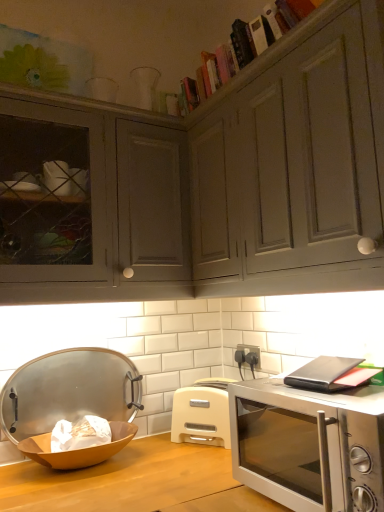
Question: Considering the relative sizes of metallic silver tray at left and silver metallic microwave oven at lower right in the image provided, is metallic silver tray at left bigger than silver metallic microwave oven at lower right?

Choices:
 (A) no
 (B) yes

Answer: (A)

Question: Is there a large distance between metallic silver tray at left and silver metallic microwave oven at lower right?

Choices:
 (A) yes
 (B) no

Answer: (B)

Question: Is silver metallic microwave oven at lower right located within metallic silver tray at left?

Choices:
 (A) no
 (B) yes

Answer: (A)

Question: Is metallic silver tray at left at the left side of silver metallic microwave oven at lower right?

Choices:
 (A) no
 (B) yes

Answer: (B)

Question: Is metallic silver tray at left oriented towards silver metallic microwave oven at lower right?

Choices:
 (A) yes
 (B) no

Answer: (A)

Question: Can you confirm if metallic silver tray at left is shorter than silver metallic microwave oven at lower right?

Choices:
 (A) no
 (B) yes

Answer: (A)

Question: Is wooden bowl at lower left positioned with its back to beige plastic toaster at center?

Choices:
 (A) yes
 (B) no

Answer: (B)

Question: Is wooden bowl at lower left far away from beige plastic toaster at center?

Choices:
 (A) yes
 (B) no

Answer: (B)

Question: Is wooden bowl at lower left to the left of beige plastic toaster at center from the viewer's perspective?

Choices:
 (A) yes
 (B) no

Answer: (A)

Question: Is wooden bowl at lower left at the right side of beige plastic toaster at center?

Choices:
 (A) no
 (B) yes

Answer: (A)

Question: Can we say wooden bowl at lower left lies outside beige plastic toaster at center?

Choices:
 (A) yes
 (B) no

Answer: (A)

Question: From the image's perspective, is wooden bowl at lower left beneath beige plastic toaster at center?

Choices:
 (A) yes
 (B) no

Answer: (A)

Question: Are wooden bowl at lower left and metallic silver tray at left far apart?

Choices:
 (A) no
 (B) yes

Answer: (A)